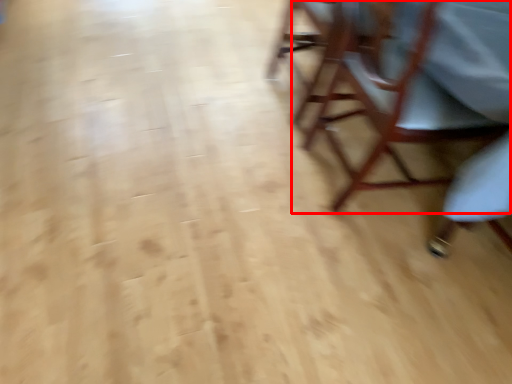
Question: From the image, what is the correct spatial relationship of chair (annotated by the red box) in relation to chair?

Choices:
 (A) right
 (B) left

Answer: (A)